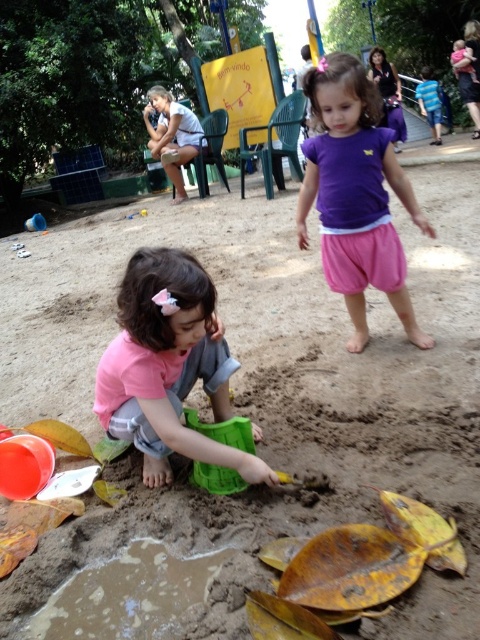
You are a parent trying to locate your children in the sandbox. You see the pink matte shirt at lower left and the purple cotton shirt at center. Which child is closer to the edge of the sandbox?

The pink matte shirt at lower left is positioned under the purple cotton shirt at center, meaning it is closer to the edge of the sandbox.